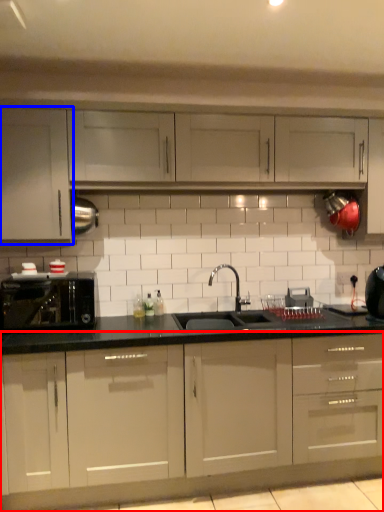
Question: Which of the following is the closest to the observer, cabinetry (highlighted by a red box) or cabinetry (highlighted by a blue box)?

Choices:
 (A) cabinetry
 (B) cabinetry

Answer: (A)